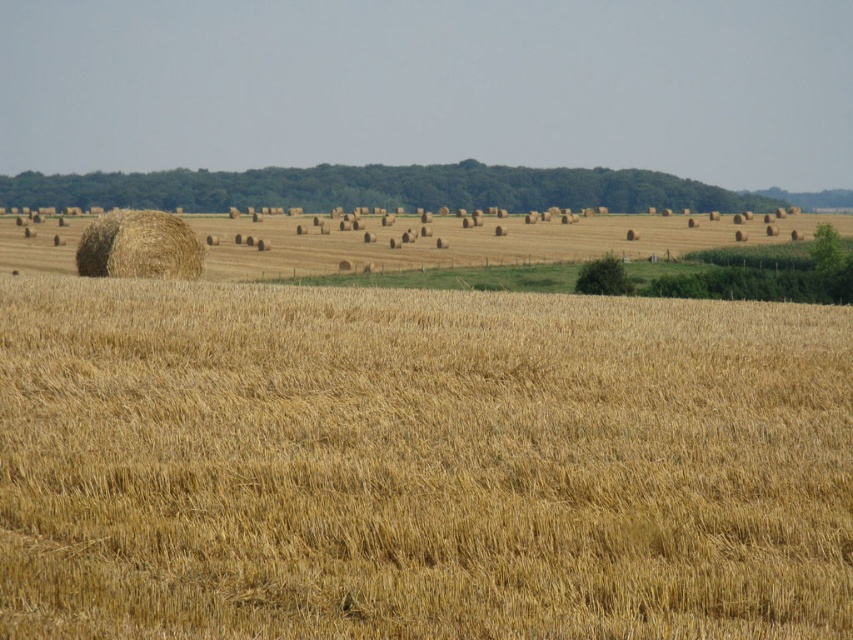
Question: Considering the real-world distances, which object is farthest from the golden straw bale at center?

Choices:
 (A) dry straw at center
 (B) golden straw bale at left

Answer: (B)

Question: Is dry straw at center behind golden straw bale at center?

Choices:
 (A) no
 (B) yes

Answer: (A)

Question: Does dry straw at center have a larger size compared to golden straw bale at left?

Choices:
 (A) no
 (B) yes

Answer: (A)

Question: Which point is closer to the camera?

Choices:
 (A) golden straw bale at left
 (B) dry straw at center
 (C) golden straw bale at center

Answer: (B)

Question: Which of these objects is positioned closest to the golden straw bale at left?

Choices:
 (A) golden straw bale at center
 (B) dry straw at center

Answer: (A)

Question: Does dry straw at center have a lesser width compared to golden straw bale at left?

Choices:
 (A) no
 (B) yes

Answer: (B)